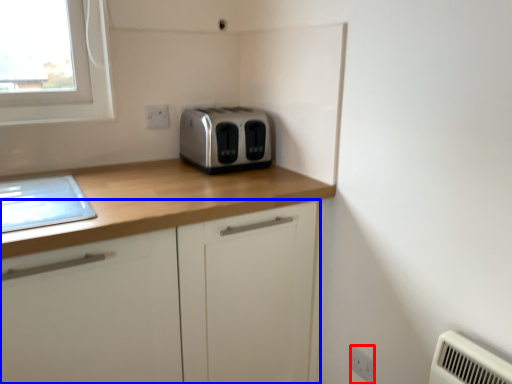
Question: Among these objects, which one is nearest to the camera, electric outlet (highlighted by a red box) or cabinetry (highlighted by a blue box)?

Choices:
 (A) electric outlet
 (B) cabinetry

Answer: (B)